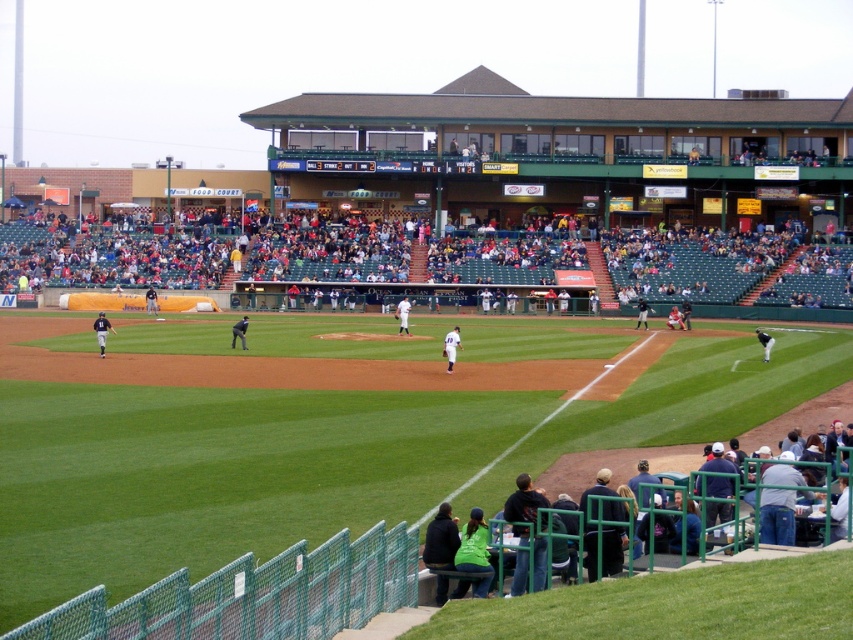
Question: Estimate the real-world distances between objects in this image. Which object is closer to the white uniform at center?

Choices:
 (A) green grass baseball field at center
 (B) dark blue uniform at center
 (C) black uniform at center
 (D) orange jersey at center

Answer: (C)

Question: Which object appears farthest from the camera in this image?

Choices:
 (A) white jersey baseball players at lower right
 (B) white jersey baseball player at center

Answer: (B)

Question: Can you confirm if green grass baseball field at center is wider than white jersey at center?

Choices:
 (A) yes
 (B) no

Answer: (A)

Question: Can you confirm if white uniform at center is thinner than white jersey baseball player at center?

Choices:
 (A) yes
 (B) no

Answer: (A)

Question: Which object is the farthest from the orange jersey at center?

Choices:
 (A) white jersey baseball player at center
 (B) white uniform at center

Answer: (A)

Question: Does white jersey at center have a larger size compared to matte black uniform at left?

Choices:
 (A) no
 (B) yes

Answer: (A)